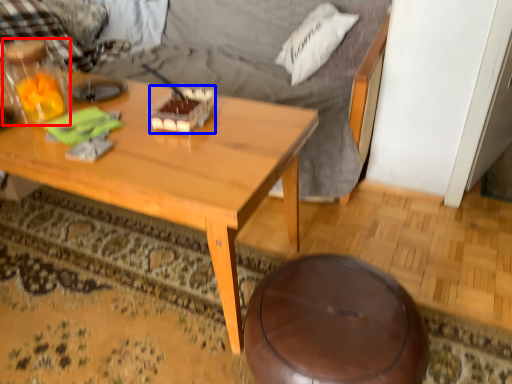
Question: Among these objects, which one is farthest to the camera, bottle (highlighted by a red box) or food (highlighted by a blue box)?

Choices:
 (A) bottle
 (B) food

Answer: (B)